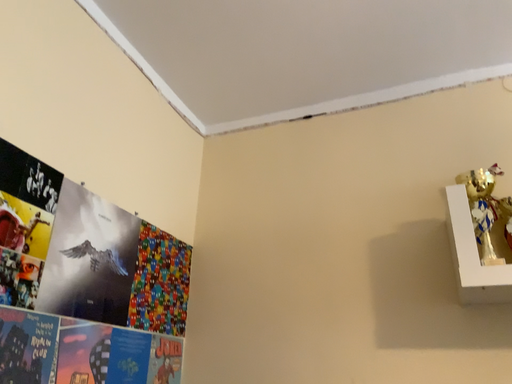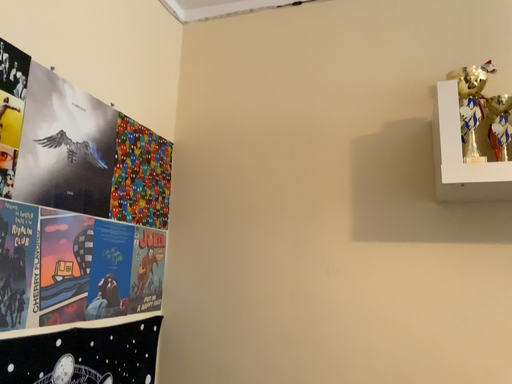
Question: Which way did the camera rotate in the video?

Choices:
 (A) rotated downward
 (B) rotated upward

Answer: (A)